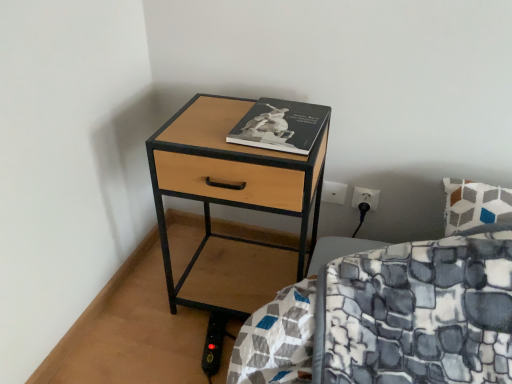
At what (x,y) coordinates should I click in order to perform the action: click on free region on the left part of black matte book at center. Please return your answer as a coordinate pair (x, y). The image size is (512, 384). Looking at the image, I should click on (210, 119).